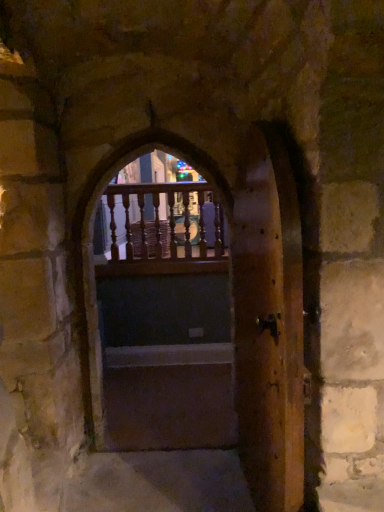
Question: Is dark wood door at center looking in the opposite direction of wooden door at center, acting as the first door starting from the left?

Choices:
 (A) no
 (B) yes

Answer: (A)

Question: Is dark wood door at center shorter than wooden door at center, the second door positioned from the right?

Choices:
 (A) yes
 (B) no

Answer: (A)

Question: Is wooden door at center, the second door positioned from the right, inside dark wood door at center?

Choices:
 (A) no
 (B) yes

Answer: (A)

Question: Is dark wood door at center to the left of wooden door at center, acting as the first door starting from the left, from the viewer's perspective?

Choices:
 (A) no
 (B) yes

Answer: (B)

Question: Considering the relative sizes of dark wood door at center and wooden door at center, the second door positioned from the right, in the image provided, is dark wood door at center taller than wooden door at center, the second door positioned from the right,?

Choices:
 (A) no
 (B) yes

Answer: (A)

Question: From the image's perspective, is dark wood door at center above wooden door at center, acting as the first door starting from the left?

Choices:
 (A) no
 (B) yes

Answer: (A)

Question: From a real-world perspective, does wooden door at center, the 2th door in the left-to-right sequence, stand above wooden balusters at center?

Choices:
 (A) no
 (B) yes

Answer: (A)

Question: Is wooden door at center, the first door viewed from the right, thinner than wooden balusters at center?

Choices:
 (A) yes
 (B) no

Answer: (B)

Question: Considering the relative sizes of wooden door at center, the 2th door in the left-to-right sequence, and wooden balusters at center in the image provided, is wooden door at center, the 2th door in the left-to-right sequence, bigger than wooden balusters at center?

Choices:
 (A) yes
 (B) no

Answer: (A)

Question: Does wooden door at center, the 2th door in the left-to-right sequence, come behind wooden balusters at center?

Choices:
 (A) yes
 (B) no

Answer: (B)

Question: Is wooden door at center, the first door viewed from the right, smaller than wooden balusters at center?

Choices:
 (A) no
 (B) yes

Answer: (A)

Question: Does wooden door at center, the 2th door in the left-to-right sequence, have a lesser height compared to wooden balusters at center?

Choices:
 (A) yes
 (B) no

Answer: (B)

Question: Are wooden balusters at center and wooden door at center, the second door positioned from the right, located far from each other?

Choices:
 (A) no
 (B) yes

Answer: (A)